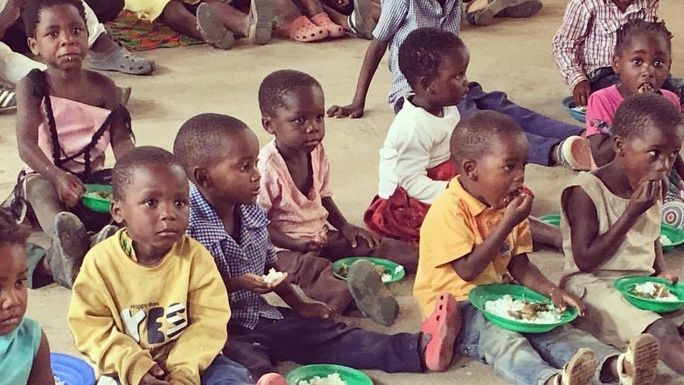
Locate an element on the screen. green plates is located at coordinates [x=89, y=202], [x=301, y=374], [x=397, y=274], [x=479, y=294], [x=641, y=298].